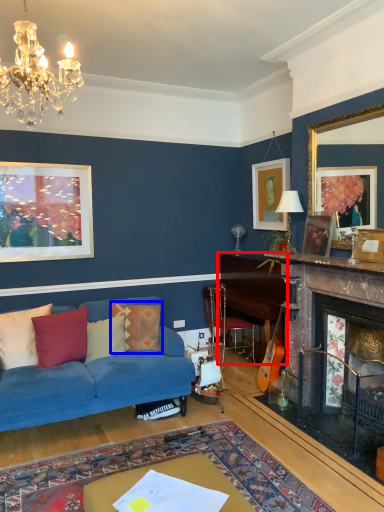
Question: Which of the following is the farthest to the observer, table (highlighted by a red box) or pillow (highlighted by a blue box)?

Choices:
 (A) table
 (B) pillow

Answer: (A)